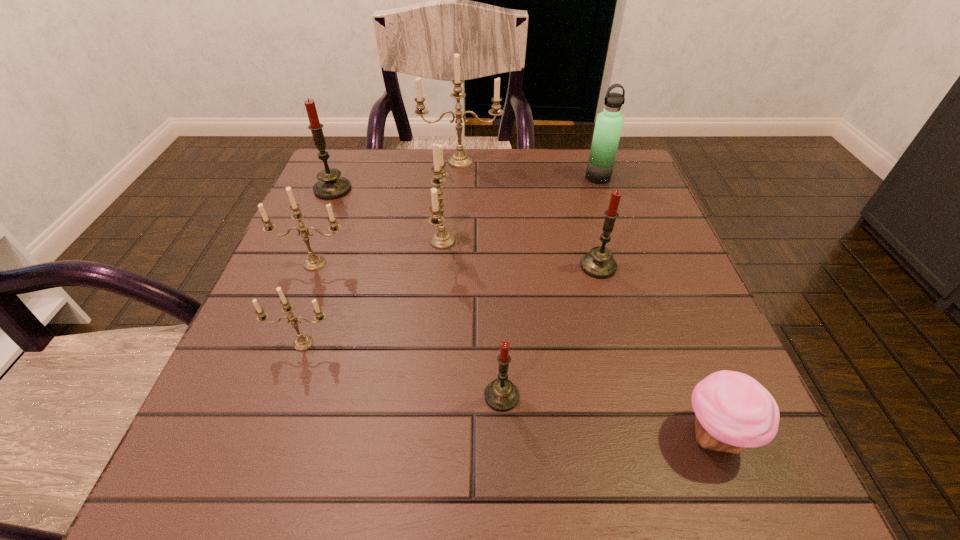
Locate an element on the screen. the third closest object relative to the third smallest metallic candle is located at coordinates [x=303, y=342].

The width and height of the screenshot is (960, 540). Find the location of `object that is the seventh closest one to the thermos bottle`. object that is the seventh closest one to the thermos bottle is located at coordinates (733, 411).

Select which candle is the second closest to the biggest metallic candle. Please provide its 2D coordinates. Your answer should be formatted as a tuple, i.e. [(x, y)], where the tuple contains the x and y coordinates of a point satisfying the conditions above.

[(441, 240)]

This screenshot has height=540, width=960. In order to click on candle that is the second closest to the biggest red candle in this screenshot , I will do `click(314, 262)`.

Find the location of a particular element. metallic candle object that ranks as the closest to the smallest red candle is located at coordinates (441, 240).

I want to click on the fourth closest metallic candle relative to the second farthest red candle, so click(x=303, y=342).

Identify which red candle is located as the nearest to the biggest red candle. Please provide its 2D coordinates. Your answer should be formatted as a tuple, i.e. [(x, y)], where the tuple contains the x and y coordinates of a point satisfying the conditions above.

[(599, 263)]

You are a GUI agent. You are given a task and a screenshot of the screen. Output one action in this format:
    pyautogui.click(x=<x>, y=<y>)
    Task: Click on the second closest red candle to the farthest red candle
    
    Given the screenshot: What is the action you would take?
    (x=501, y=395)

Find the location of `free spot that satisfies the following two spatial constraints: 1. on the front side of the second smallest metallic candle; 2. on the left side of the farthest red candle`. free spot that satisfies the following two spatial constraints: 1. on the front side of the second smallest metallic candle; 2. on the left side of the farthest red candle is located at coordinates (301, 264).

Where is `vacant region that satisfies the following two spatial constraints: 1. on the front side of the biggest metallic candle; 2. on the left side of the rightmost candle`? The height and width of the screenshot is (540, 960). vacant region that satisfies the following two spatial constraints: 1. on the front side of the biggest metallic candle; 2. on the left side of the rightmost candle is located at coordinates (454, 266).